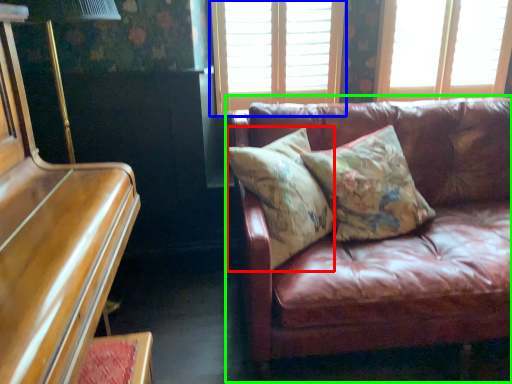
Question: Estimate the real-world distances between objects in this image. Which object is closer to pillow (highlighted by a red box), window (highlighted by a blue box) or studio couch (highlighted by a green box)?

Choices:
 (A) window
 (B) studio couch

Answer: (B)